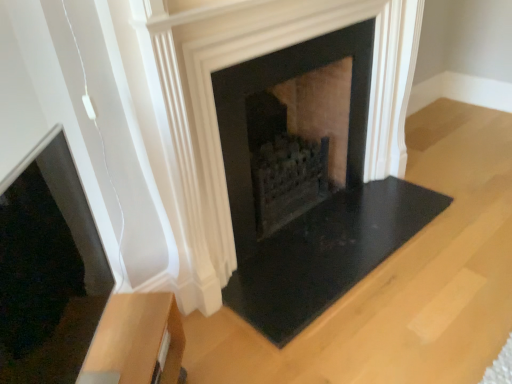
Identify the location of free spot in front of black stone fireplace at center. Image resolution: width=512 pixels, height=384 pixels. (347, 328).